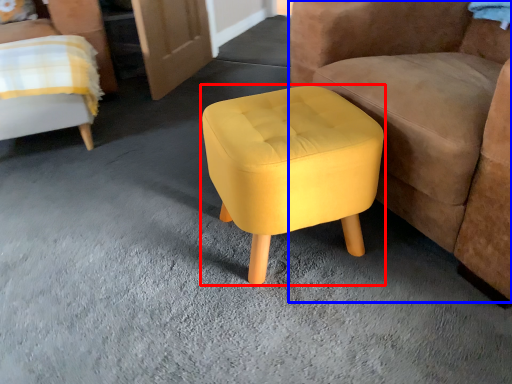
Question: Among these objects, which one is nearest to the camera, stool (highlighted by a red box) or chair (highlighted by a blue box)?

Choices:
 (A) stool
 (B) chair

Answer: (B)